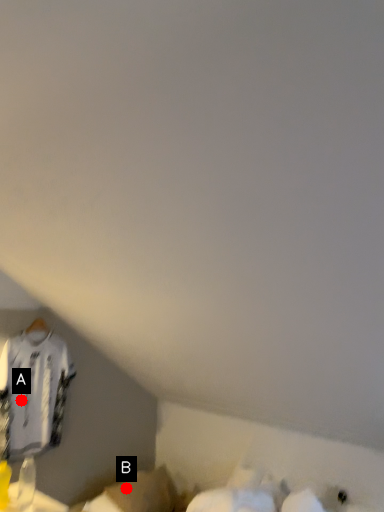
Question: Two points are circled on the image, labeled by A and B beside each circle. Which of the following is the closest to the observer?

Choices:
 (A) A is closer
 (B) B is closer

Answer: (A)